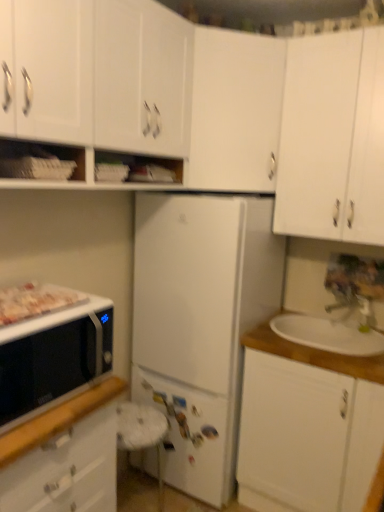
Question: Is metallic silver faucet at upper right positioned in front of white matte microwave at lower left, the 1th cabinetry positioned from the left?

Choices:
 (A) yes
 (B) no

Answer: (B)

Question: From the image's perspective, is metallic silver faucet at upper right on white matte microwave at lower left, the 1th cabinetry positioned from the left?

Choices:
 (A) no
 (B) yes

Answer: (B)

Question: Can you confirm if metallic silver faucet at upper right is shorter than white matte microwave at lower left, the 1th cabinetry positioned from the left?

Choices:
 (A) no
 (B) yes

Answer: (B)

Question: Does metallic silver faucet at upper right have a lesser width compared to white matte microwave at lower left, the 5th cabinetry when ordered from right to left?

Choices:
 (A) no
 (B) yes

Answer: (B)

Question: Is white matte microwave at lower left, the 1th cabinetry positioned from the left, surrounded by metallic silver faucet at upper right?

Choices:
 (A) no
 (B) yes

Answer: (A)

Question: In terms of width, does white matte cabinet at upper left, arranged as the second cabinetry when viewed from the left, look wider or thinner when compared to metallic silver faucet at upper right?

Choices:
 (A) thin
 (B) wide

Answer: (B)

Question: In terms of size, does white matte cabinet at upper left, which is the 4th cabinetry from right to left, appear bigger or smaller than metallic silver faucet at upper right?

Choices:
 (A) small
 (B) big

Answer: (B)

Question: In the image, is white matte cabinet at upper left, which is the 4th cabinetry from right to left, positioned in front of or behind metallic silver faucet at upper right?

Choices:
 (A) front
 (B) behind

Answer: (A)

Question: Choose the correct answer: Is white matte cabinet at upper left, arranged as the second cabinetry when viewed from the left, inside metallic silver faucet at upper right or outside it?

Choices:
 (A) inside
 (B) outside

Answer: (B)

Question: Looking at the image, does white matte cabinet at upper center, which is the 3th cabinetry in left-to-right order, seem bigger or smaller compared to white matte microwave at lower left, the 5th cabinetry when ordered from right to left?

Choices:
 (A) big
 (B) small

Answer: (B)

Question: Would you say white matte cabinet at upper center, which is the 3th cabinetry in left-to-right order, is inside or outside white matte microwave at lower left, the 5th cabinetry when ordered from right to left?

Choices:
 (A) inside
 (B) outside

Answer: (B)

Question: From the image's perspective, is white matte cabinet at upper center, marked as the third cabinetry in a right-to-left arrangement, positioned above or below white matte microwave at lower left, the 5th cabinetry when ordered from right to left?

Choices:
 (A) below
 (B) above

Answer: (B)

Question: Relative to white matte microwave at lower left, the 5th cabinetry when ordered from right to left, is white matte cabinet at upper center, marked as the third cabinetry in a right-to-left arrangement, in front or behind?

Choices:
 (A) behind
 (B) front

Answer: (A)

Question: Considering the positions of white glossy tray at left and white matte cabinet at upper left, arranged as the second cabinetry when viewed from the left, in the image, is white glossy tray at left wider or thinner than white matte cabinet at upper left, arranged as the second cabinetry when viewed from the left,?

Choices:
 (A) thin
 (B) wide

Answer: (A)

Question: In terms of height, does white glossy tray at left look taller or shorter compared to white matte cabinet at upper left, arranged as the second cabinetry when viewed from the left?

Choices:
 (A) short
 (B) tall

Answer: (A)